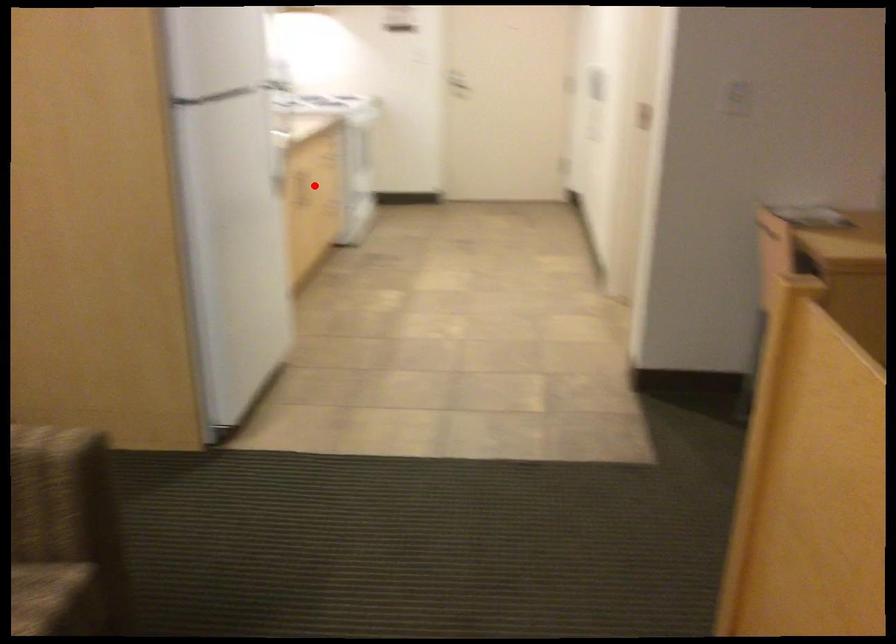
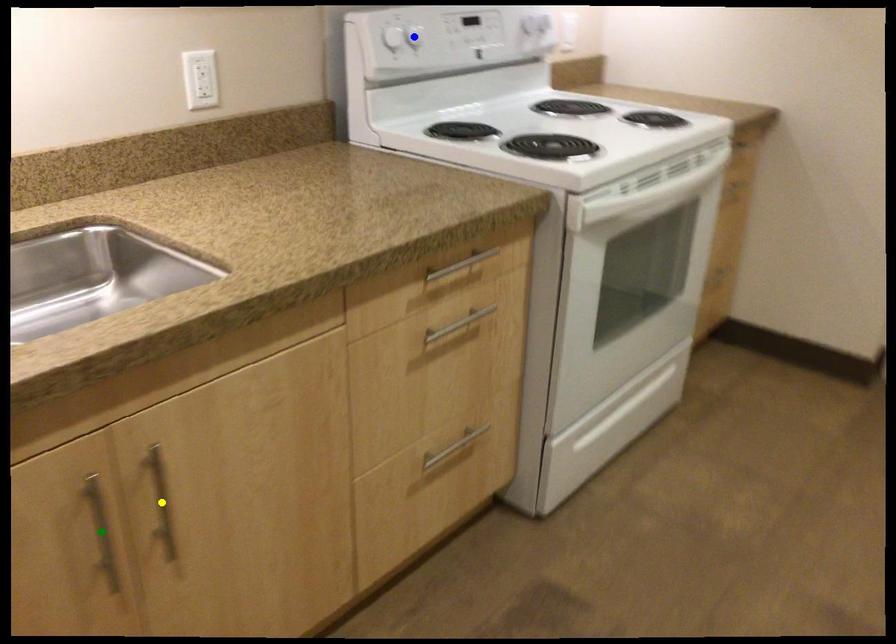
Question: I am providing you with two images of the same scene from different viewpoints. A red point is marked on the first image. You are given multiple points on the second image. Which point in image 2 represents the same 3d spot as the red point in image 1?

Choices:
 (A) blue point
 (B) yellow point
 (C) green point

Answer: (C)